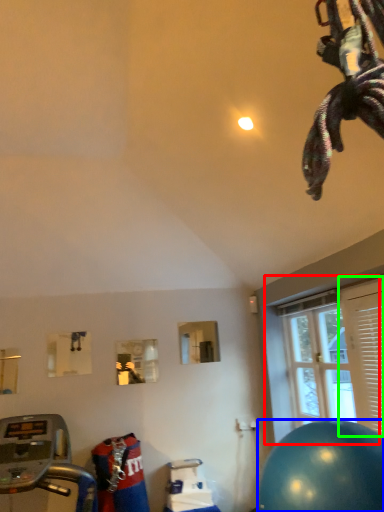
Question: Which is farther away from window (highlighted by a red box)? ball (highlighted by a blue box) or shutter (highlighted by a green box)?

Choices:
 (A) ball
 (B) shutter

Answer: (A)